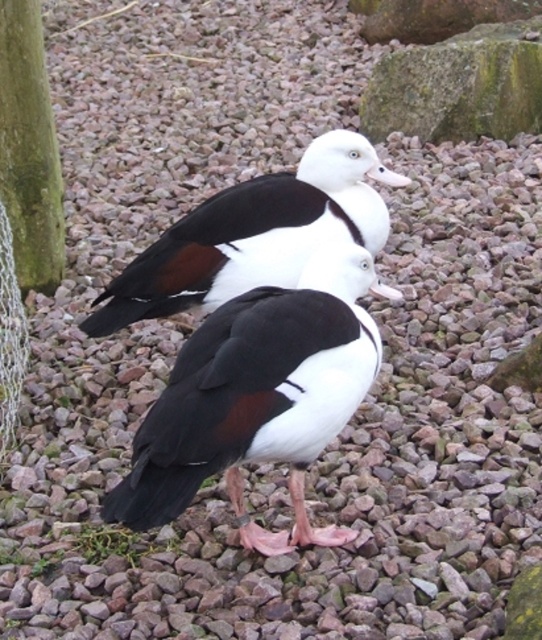
Does white glossy duck at center have a larger size compared to green mossy tree trunk at left?

Yes.

At what (x,y) coordinates should I click in order to perform the action: click on white glossy duck at center. Please return your answer as a coordinate pair (x, y). Looking at the image, I should click on (250, 236).

The height and width of the screenshot is (640, 542). I want to click on white glossy duck at center, so click(250, 236).

Between point (218, 426) and point (402, 294), which one is positioned in front?

Point (218, 426) is more forward.

Between point (324, 337) and point (382, 289), which one is positioned in front?

Point (324, 337) is in front.

This screenshot has width=542, height=640. What are the coordinates of `black glossy duck at center` in the screenshot? It's located at (257, 397).

Does black glossy duck at center lie behind white glossy beak at upper center?

No.

Is point (244, 532) closer to camera compared to point (376, 173)?

Yes.

Find the location of a particular element. black glossy duck at center is located at coordinates (257, 397).